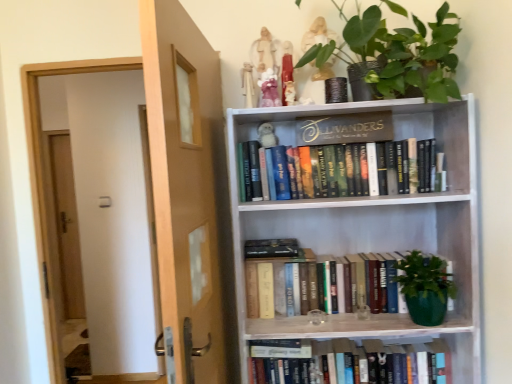
Question: Considering the relative positions of hardcover books at center, the second book ordered from the bottom, and green matte plant at upper center in the image provided, is hardcover books at center, the second book ordered from the bottom, to the right of green matte plant at upper center from the viewer's perspective?

Choices:
 (A) no
 (B) yes

Answer: (A)

Question: From a real-world perspective, is hardcover books at center, the second book ordered from the bottom, over green matte plant at upper center?

Choices:
 (A) no
 (B) yes

Answer: (A)

Question: From a real-world perspective, is hardcover books at center, acting as the second book starting from the top, beneath green matte plant at upper center?

Choices:
 (A) no
 (B) yes

Answer: (B)

Question: Is hardcover books at center, the second book ordered from the bottom, looking in the opposite direction of green matte plant at upper center?

Choices:
 (A) no
 (B) yes

Answer: (A)

Question: Would you say hardcover books at center, acting as the second book starting from the top, contains green matte plant at upper center?

Choices:
 (A) no
 (B) yes

Answer: (A)

Question: Considering the positions of white porcelain owl at upper center, the second toy in the right-to-left sequence, and white fabric doll at upper center, which is the 5th toy in right-to-left order, in the image, is white porcelain owl at upper center, the second toy in the right-to-left sequence, taller or shorter than white fabric doll at upper center, which is the 5th toy in right-to-left order,?

Choices:
 (A) tall
 (B) short

Answer: (B)

Question: Considering the relative positions of white porcelain owl at upper center, placed as the fourth toy when sorted from left to right, and white fabric doll at upper center, which is the 5th toy in right-to-left order, in the image provided, is white porcelain owl at upper center, placed as the fourth toy when sorted from left to right, to the left or to the right of white fabric doll at upper center, which is the 5th toy in right-to-left order,?

Choices:
 (A) right
 (B) left

Answer: (A)

Question: Does point (291, 82) appear closer or farther from the camera than point (253, 100)?

Choices:
 (A) closer
 (B) farther

Answer: (B)

Question: Choose the correct answer: Is white porcelain owl at upper center, the second toy in the right-to-left sequence, inside white fabric doll at upper center, which is the 5th toy in right-to-left order, or outside it?

Choices:
 (A) outside
 (B) inside

Answer: (A)

Question: From a real-world perspective, is gold metallic sign at upper center above or below white plush monkey at upper center, which appears as the 2th toy when viewed from the left?

Choices:
 (A) above
 (B) below

Answer: (B)

Question: Is point (350, 127) closer or farther from the camera than point (261, 144)?

Choices:
 (A) farther
 (B) closer

Answer: (B)

Question: Visually, is gold metallic sign at upper center positioned to the left or to the right of white plush monkey at upper center, which appears as the 2th toy when viewed from the left?

Choices:
 (A) left
 (B) right

Answer: (B)

Question: Is gold metallic sign at upper center in front of or behind white plush monkey at upper center, which appears as the 2th toy when viewed from the left, in the image?

Choices:
 (A) behind
 (B) front

Answer: (B)

Question: In terms of width, does matte white figurine at upper center, which is the first toy in right-to-left order, look wider or thinner when compared to green matte plant at upper center?

Choices:
 (A) thin
 (B) wide

Answer: (A)

Question: From a real-world perspective, is matte white figurine at upper center, which is the first toy in right-to-left order, physically located above or below green matte plant at upper center?

Choices:
 (A) below
 (B) above

Answer: (A)